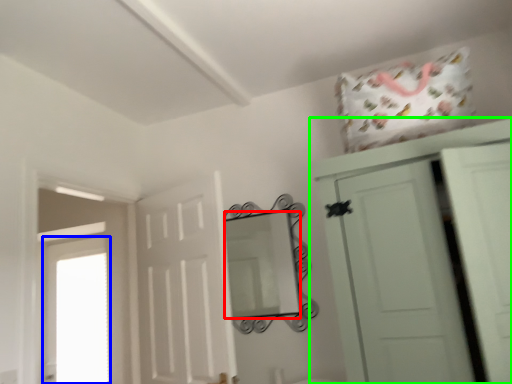
Question: Based on their relative distances, which object is nearer to mirror (highlighted by a red box)? Choose from window (highlighted by a blue box) and cupboard (highlighted by a green box).

Choices:
 (A) window
 (B) cupboard

Answer: (B)